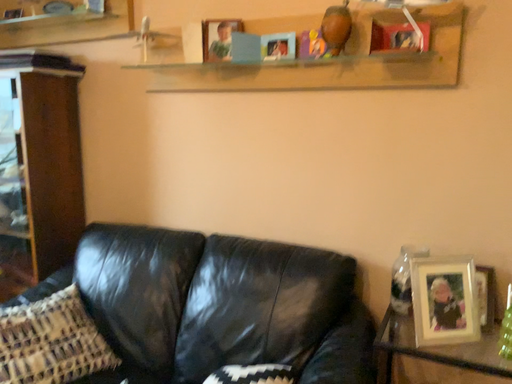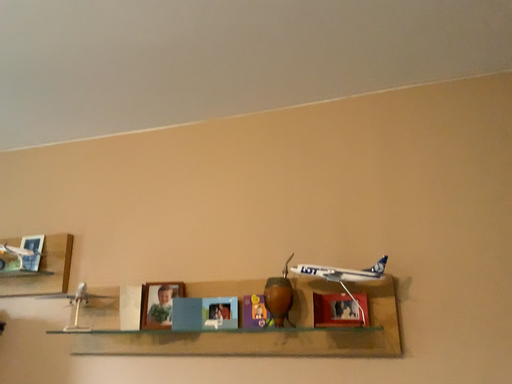
Question: Which way did the camera rotate in the video?

Choices:
 (A) rotated downward
 (B) rotated upward

Answer: (B)